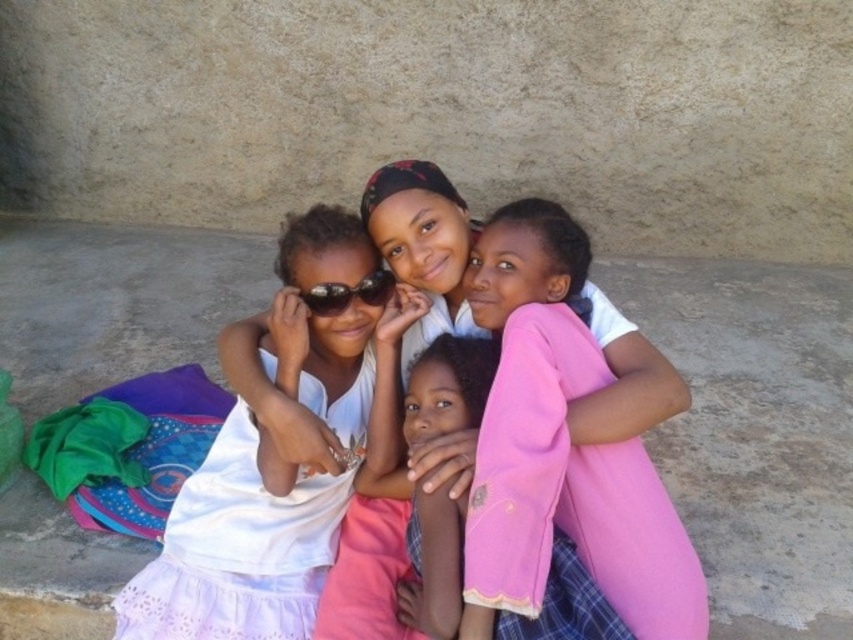
You are a photographer standing at the camera position. You need to adjust the focus to capture the white lace dress at lower left clearly. What is the minimum distance you should set the focus to ensure the dress is in focus?

The minimum distance you should set the focus to ensure the white lace dress at lower left is in focus is 1.60 meters, as the dress is 1.60 meters away from the camera.

You are a photographer adjusting the camera focus. The white lace dress at lower left and the sunglasses at center are both in the frame. Which object should you focus on first if you need to prioritize the taller one?

The white lace dress at lower left is taller than the sunglasses at center, so you should focus on the white lace dress at lower left first.

You are an artist trying to sketch this scene. You want to place the white lace dress at lower left in your drawing. Where should you position it on the canvas using coordinates?

Position the white lace dress at lower left at coordinates approximately 0.859 on the x axis and 0.279 on the y axis.